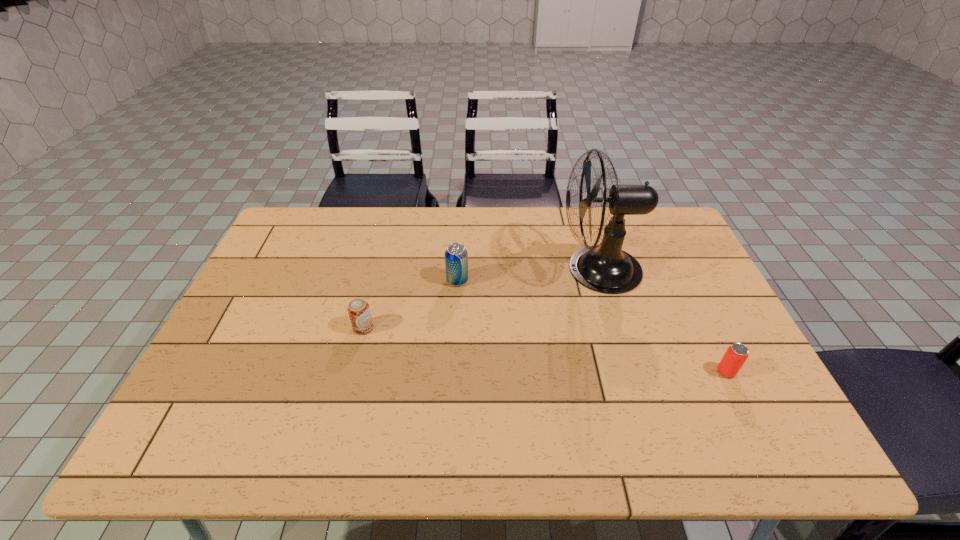
Image resolution: width=960 pixels, height=540 pixels. In order to click on vacant space at the far right corner of the desktop in this screenshot , I will do `click(650, 248)`.

You are a GUI agent. You are given a task and a screenshot of the screen. Output one action in this format:
    pyautogui.click(x=<x>, y=<y>)
    Task: Click on the free space at the near right corner of the desktop
    This screenshot has height=540, width=960.
    Given the screenshot: What is the action you would take?
    pyautogui.click(x=746, y=438)

At what (x,y) coordinates should I click in order to perform the action: click on unoccupied position between the nearest beer can and the tallest object. Please return your answer as a coordinate pair (x, y). The width and height of the screenshot is (960, 540). Looking at the image, I should click on (662, 320).

This screenshot has width=960, height=540. I want to click on free space between the third object from left to right and the leftmost object, so click(481, 299).

At what (x,y) coordinates should I click in order to perform the action: click on empty location between the tallest object and the farthest beer can. Please return your answer as a coordinate pair (x, y). Looking at the image, I should click on (528, 275).

Identify the location of empty location between the third shortest object and the leftmost object. The image size is (960, 540). (410, 304).

The width and height of the screenshot is (960, 540). In order to click on free spot between the tallest object and the third object from right to left in this screenshot , I will do [528, 275].

This screenshot has width=960, height=540. Find the location of `vacant region between the nearest object and the tallest object`. vacant region between the nearest object and the tallest object is located at coordinates (662, 320).

Locate an element on the screen. Image resolution: width=960 pixels, height=540 pixels. empty space between the rightmost object and the third shortest object is located at coordinates (591, 326).

Image resolution: width=960 pixels, height=540 pixels. I want to click on vacant space in between the tallest object and the second beer can from right to left, so pyautogui.click(x=528, y=275).